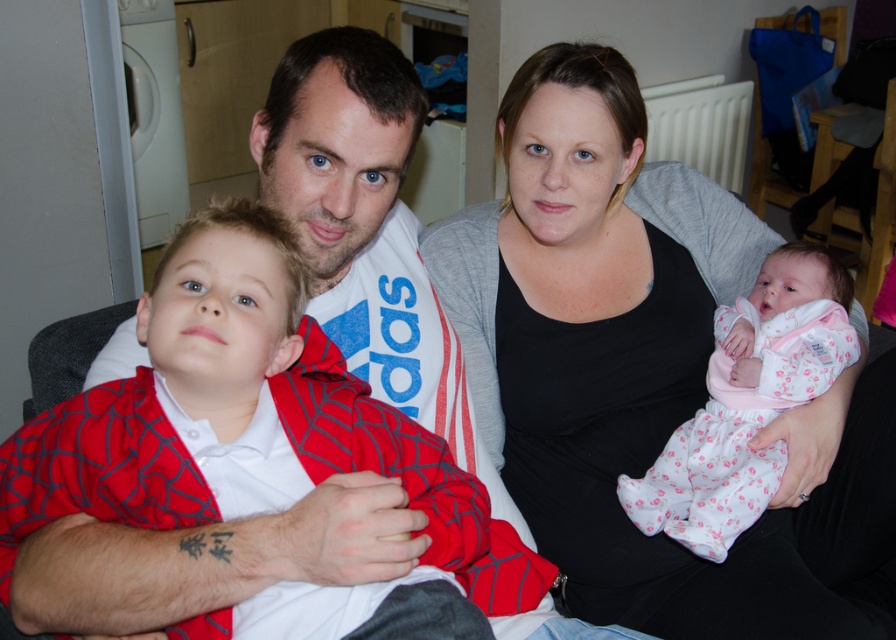
Question: Which point is farther from the camera taking this photo?

Choices:
 (A) (536, 60)
 (B) (0, 484)
 (C) (750, 509)

Answer: (A)

Question: In this image, where is black matte tank top at center located relative to matte red onesie at center?

Choices:
 (A) below
 (B) above

Answer: (B)

Question: Estimate the real-world distances between objects in this image. Which object is closer to the matte red onesie at center?

Choices:
 (A) pink fabric baby at center
 (B) black matte tank top at center

Answer: (B)

Question: From the image, what is the correct spatial relationship of black matte tank top at center in relation to matte red onesie at center?

Choices:
 (A) below
 (B) above

Answer: (B)

Question: Estimate the real-world distances between objects in this image. Which object is closer to the black matte tank top at center?

Choices:
 (A) pink fabric baby at center
 (B) matte red onesie at center

Answer: (A)

Question: In this image, where is matte red onesie at center located relative to pink fabric baby at center?

Choices:
 (A) right
 (B) left

Answer: (B)